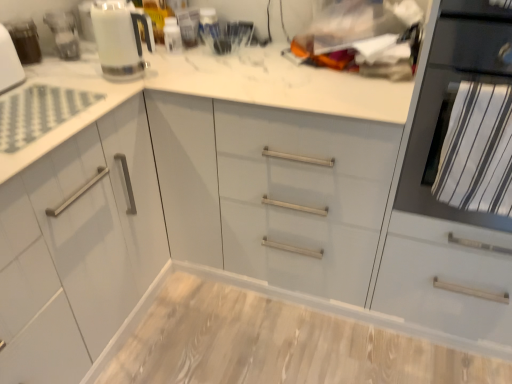
Locate an element on the screen. This screenshot has height=384, width=512. free space above wooden at center (from a real-world perspective) is located at coordinates (286, 341).